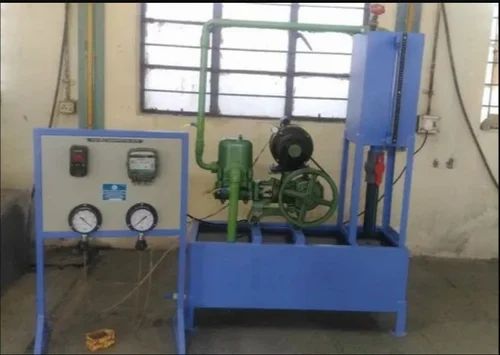
The image size is (500, 355). I want to click on wires, so click(x=152, y=273), click(x=138, y=269), click(x=86, y=265), click(x=59, y=82), click(x=225, y=206), click(x=263, y=146), click(x=398, y=178), click(x=431, y=71), click(x=454, y=75).